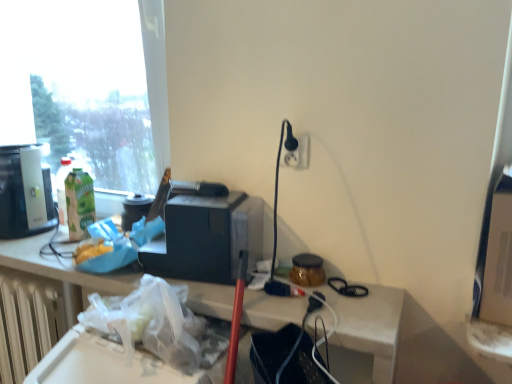
Question: From a real-world perspective, is black plastic toaster at center, which is the second appliance in right-to-left order, over white plastic electric outlet at upper right?

Choices:
 (A) no
 (B) yes

Answer: (A)

Question: Is black plastic toaster at center, which is the 1th appliance in left-to-right order, to the left of white plastic electric outlet at upper right from the viewer's perspective?

Choices:
 (A) yes
 (B) no

Answer: (A)

Question: Can we say black plastic toaster at center, which is the second appliance in right-to-left order, lies outside white plastic electric outlet at upper right?

Choices:
 (A) no
 (B) yes

Answer: (B)

Question: Can you confirm if black plastic toaster at center, which is the 1th appliance in left-to-right order, is positioned to the right of white plastic electric outlet at upper right?

Choices:
 (A) yes
 (B) no

Answer: (B)

Question: Is black plastic toaster at center, which is the 1th appliance in left-to-right order, touching white plastic electric outlet at upper right?

Choices:
 (A) no
 (B) yes

Answer: (A)

Question: Considering the relative sizes of black plastic toaster at center, which is the 1th appliance in left-to-right order, and white plastic electric outlet at upper right in the image provided, is black plastic toaster at center, which is the 1th appliance in left-to-right order, smaller than white plastic electric outlet at upper right?

Choices:
 (A) no
 (B) yes

Answer: (A)

Question: Does white plastic radiator at lower left appear on the right side of black plastic toaster at center, which is the 1th appliance in left-to-right order?

Choices:
 (A) no
 (B) yes

Answer: (A)

Question: Considering the relative positions of white plastic radiator at lower left and black plastic toaster at center, which is the 1th appliance in left-to-right order, in the image provided, is white plastic radiator at lower left to the left of black plastic toaster at center, which is the 1th appliance in left-to-right order, from the viewer's perspective?

Choices:
 (A) no
 (B) yes

Answer: (B)

Question: Is white plastic radiator at lower left with black plastic toaster at center, which is the second appliance in right-to-left order?

Choices:
 (A) yes
 (B) no

Answer: (B)

Question: Is white plastic radiator at lower left smaller than black plastic toaster at center, which is the second appliance in right-to-left order?

Choices:
 (A) yes
 (B) no

Answer: (B)

Question: Is white plastic radiator at lower left thinner than black plastic toaster at center, which is the second appliance in right-to-left order?

Choices:
 (A) no
 (B) yes

Answer: (B)

Question: Is white plastic radiator at lower left not within black plastic toaster at center, which is the second appliance in right-to-left order?

Choices:
 (A) no
 (B) yes

Answer: (B)

Question: Are translucent glass jar at center, positioned as the 2th appliance in left-to-right order, and black plastic toaster at center, which is the 1th appliance in left-to-right order, located far from each other?

Choices:
 (A) yes
 (B) no

Answer: (B)